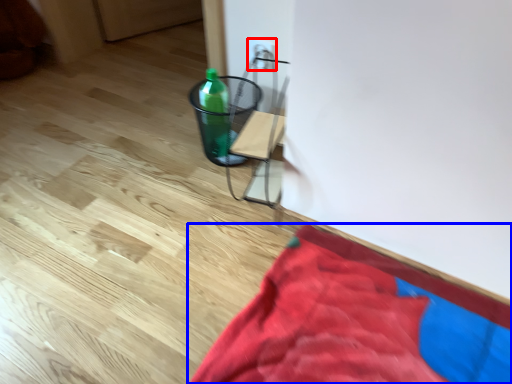
Question: Among these objects, which one is farthest to the camera, electric outlet (highlighted by a red box) or blanket (highlighted by a blue box)?

Choices:
 (A) electric outlet
 (B) blanket

Answer: (A)